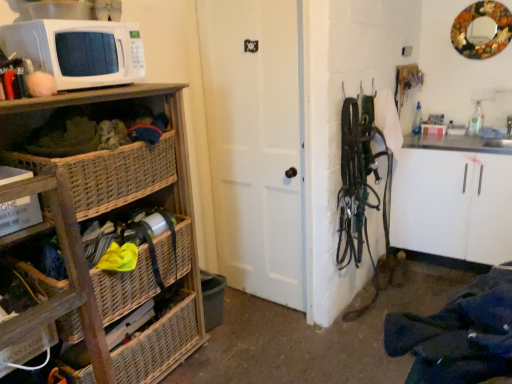
You are a GUI agent. You are given a task and a screenshot of the screen. Output one action in this format:
    pyautogui.click(x=<x>, y=<y>)
    Task: Click on the white matte microwave at upper left
    
    Given the screenshot: What is the action you would take?
    pyautogui.click(x=79, y=51)

Measure the distance between woven wood basket at left and camera.

A distance of 1.34 meters exists between woven wood basket at left and camera.

Describe the element at coordinates (114, 100) in the screenshot. I see `woven wood basket at left` at that location.

Measure the distance between woven wicker basket at lower left, which is counted as the second basket, starting from the bottom, and camera.

The depth of woven wicker basket at lower left, which is counted as the second basket, starting from the bottom, is 4.84 feet.

What are the coordinates of `dark blue fabric at lower right` in the screenshot? It's located at (459, 334).

Locate an element on the screen. The width and height of the screenshot is (512, 384). woven wood shelf at left is located at coordinates (86, 247).

This screenshot has height=384, width=512. What are the coordinates of `white matte microwave at upper left` in the screenshot? It's located at (79, 51).

From a real-world perspective, is white matte door at center positioned above or below woven wicker basket at lower left, which is counted as the second basket, starting from the bottom?

From a real-world perspective, white matte door at center is physically above woven wicker basket at lower left, which is counted as the second basket, starting from the bottom.

Between point (297, 287) and point (100, 290), which one is positioned behind?

The point (297, 287) is farther from the camera.

Consider the image. Is white matte door at center not near woven wicker basket at lower left, which ranks as the first basket in top-to-bottom order?

No.

Is white matte door at center taller or shorter than woven wicker basket at lower left, which is counted as the second basket, starting from the bottom?

white matte door at center is taller than woven wicker basket at lower left, which is counted as the second basket, starting from the bottom.

Where is `the 2nd basket counting from the left side of the dark blue fabric at lower right`? The image size is (512, 384). the 2nd basket counting from the left side of the dark blue fabric at lower right is located at coordinates (158, 346).

In the image, is dark blue fabric at lower right on the left side or the right side of woven wood basket at lower left, which is counted as the second basket, starting from the top?

dark blue fabric at lower right is positioned on woven wood basket at lower left, which is counted as the second basket, starting from the top,'s right side.

Can you confirm if dark blue fabric at lower right is shorter than woven wood basket at lower left, the first basket positioned from the bottom?

Yes.

Which of these two, dark blue fabric at lower right or woven wood basket at lower left, which is counted as the second basket, starting from the top, is bigger?

With larger size is woven wood basket at lower left, which is counted as the second basket, starting from the top.

Is white matte microwave at upper left oriented away from white matte door at center?

white matte microwave at upper left does not have its back to white matte door at center.

Who is shorter, white matte microwave at upper left or white matte door at center?

Standing shorter between the two is white matte microwave at upper left.

Based on the photo, which object is further away from the camera, white matte microwave at upper left or white matte door at center?

white matte door at center.

Can you see dark blue fabric at lower right touching white matte microwave at upper left?

No, dark blue fabric at lower right is not next to white matte microwave at upper left.

From the image's perspective, would you say dark blue fabric at lower right is shown under white matte microwave at upper left?

Yes, from the image's perspective, dark blue fabric at lower right is below white matte microwave at upper left.

Is the depth of dark blue fabric at lower right greater than that of white matte microwave at upper left?

That is False.

Considering the relative sizes of dark blue fabric at lower right and white matte microwave at upper left in the image provided, is dark blue fabric at lower right wider than white matte microwave at upper left?

No, dark blue fabric at lower right is not wider than white matte microwave at upper left.

Locate an element on the screen. This screenshot has height=384, width=512. the 2nd basket below when counting from the woven wood basket at left (from the image's perspective) is located at coordinates (158, 346).

From the image's perspective, relative to woven wood basket at left, is woven wood basket at lower left, the first basket positioned from the bottom, above or below?

Clearly, from the image's perspective, woven wood basket at lower left, the first basket positioned from the bottom, is below woven wood basket at left.

Can you confirm if woven wood basket at lower left, the first basket positioned from the bottom, is smaller than woven wood basket at left?

No.

Which of these two, woven wood basket at lower left, the first basket positioned from the bottom, or woven wood basket at left, stands shorter?

woven wood basket at left.

Image resolution: width=512 pixels, height=384 pixels. Find the location of `shelf behind the dark blue fabric at lower right`. shelf behind the dark blue fabric at lower right is located at coordinates (114, 100).

Is woven wood basket at left thinner than dark blue fabric at lower right?

No, woven wood basket at left is not thinner than dark blue fabric at lower right.

Which is more to the left, woven wicker basket at lower left, which is counted as the second basket, starting from the bottom, or woven wood basket at left?

woven wood basket at left.

Does woven wicker basket at lower left, which is counted as the second basket, starting from the bottom, have a larger size compared to woven wood basket at left?

Yes.

Who is shorter, woven wicker basket at lower left, which is counted as the second basket, starting from the bottom, or woven wood basket at left?

Standing shorter between the two is woven wood basket at left.

Considering the positions of points (115, 306) and (182, 88), is point (115, 306) closer to camera compared to point (182, 88)?

Yes, it is in front of point (182, 88).

Find the location of a particular element. The height and width of the screenshot is (384, 512). basket that is the 1st object located below the white matte door at center (from the image's perspective) is located at coordinates (124, 288).

This screenshot has height=384, width=512. Find the location of `clothing in front of the woven wood basket at lower left, which is counted as the second basket, starting from the top`. clothing in front of the woven wood basket at lower left, which is counted as the second basket, starting from the top is located at coordinates pyautogui.click(x=459, y=334).

Based on their spatial positions, is white matte door at center or dark blue fabric at lower right closer to woven wood basket at left?

The object closer to woven wood basket at left is white matte door at center.

From the image, which object appears to be farther from woven wood basket at left, woven wood basket at lower left, which is counted as the second basket, starting from the top, or white matte door at center?

Among the two, woven wood basket at lower left, which is counted as the second basket, starting from the top, is located further to woven wood basket at left.

Which object lies nearer to the anchor point white matte microwave at upper left, woven wicker basket at lower left, which is counted as the second basket, starting from the bottom, or woven wood basket at left?

woven wood basket at left lies closer to white matte microwave at upper left than the other object.

Estimate the real-world distances between objects in this image. Which object is closer to woven wood shelf at left, woven wicker basket at lower left, which ranks as the first basket in top-to-bottom order, or white matte door at center?

woven wicker basket at lower left, which ranks as the first basket in top-to-bottom order, lies closer to woven wood shelf at left than the other object.

Considering their positions, is woven wicker basket at lower left, which is counted as the second basket, starting from the bottom, positioned closer to woven wood shelf at left than woven wood basket at left?

woven wicker basket at lower left, which is counted as the second basket, starting from the bottom.

From the image, which object appears to be farther from white matte microwave at upper left, woven wood shelf at left or white matte door at center?

white matte door at center is positioned further to the anchor white matte microwave at upper left.

Looking at the image, which one is located further to white matte microwave at upper left, woven wicker basket at lower left, which is counted as the second basket, starting from the bottom, or dark blue fabric at lower right?

Based on the image, dark blue fabric at lower right appears to be further to white matte microwave at upper left.

Looking at this image, considering their positions, is woven wicker basket at lower left, which is counted as the second basket, starting from the bottom, positioned closer to woven wood basket at lower left, the first basket positioned from the bottom, than white matte microwave at upper left?

woven wicker basket at lower left, which is counted as the second basket, starting from the bottom.

Find the location of a particular element. The height and width of the screenshot is (384, 512). basket between white matte microwave at upper left and woven wood basket at lower left, the first basket positioned from the bottom, in the up-down direction is located at coordinates (124, 288).

Where is `shelf located between woven wood shelf at left and woven wicker basket at lower left, which ranks as the first basket in top-to-bottom order, in the depth direction`? shelf located between woven wood shelf at left and woven wicker basket at lower left, which ranks as the first basket in top-to-bottom order, in the depth direction is located at coordinates (114, 100).

Find the location of a particular element. This screenshot has width=512, height=384. cabinetry between white matte microwave at upper left and dark blue fabric at lower right from left to right is located at coordinates (86, 247).

The width and height of the screenshot is (512, 384). Identify the location of cabinetry between white matte door at center and woven wood basket at lower left, the first basket positioned from the bottom, in the up-down direction. (86, 247).